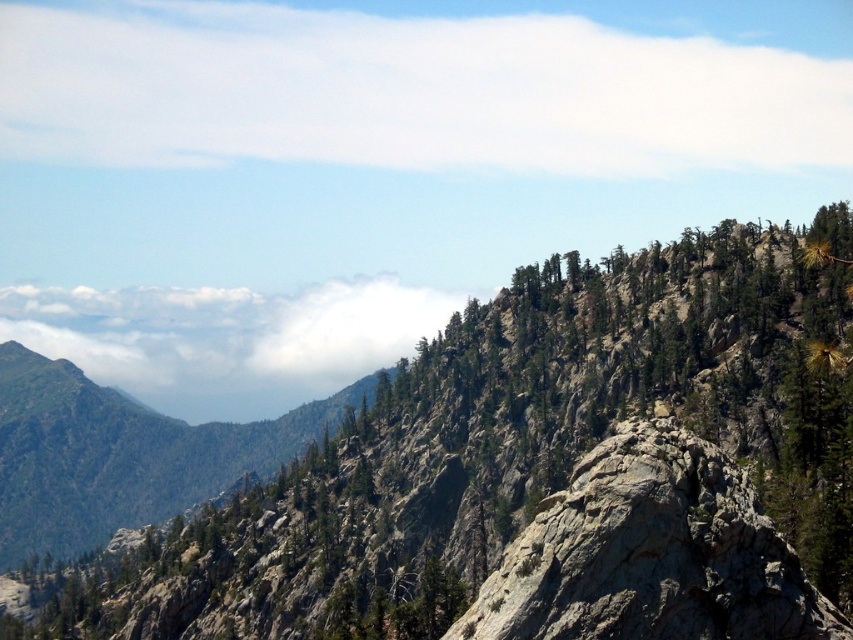
Question: Where is white fluffy cloud at upper center located in relation to green rocky mountain at center in the image?

Choices:
 (A) above
 (B) below

Answer: (A)

Question: Which of the following is the closest to the observer?

Choices:
 (A) (631, 525)
 (B) (4, 552)
 (C) (164, 444)

Answer: (A)

Question: Is green textured tree at upper center to the left of white fluffy cloud at upper center from the viewer's perspective?

Choices:
 (A) no
 (B) yes

Answer: (B)

Question: Which point is farther from the camera taking this photo?

Choices:
 (A) (331, 156)
 (B) (33, 461)
 (C) (706, 333)

Answer: (A)

Question: Which point appears closest to the camera in this image?

Choices:
 (A) (851, 68)
 (B) (469, 426)
 (C) (120, 468)

Answer: (B)

Question: Is white fluffy cloud at upper left wider than green rocky mountain at center?

Choices:
 (A) yes
 (B) no

Answer: (A)